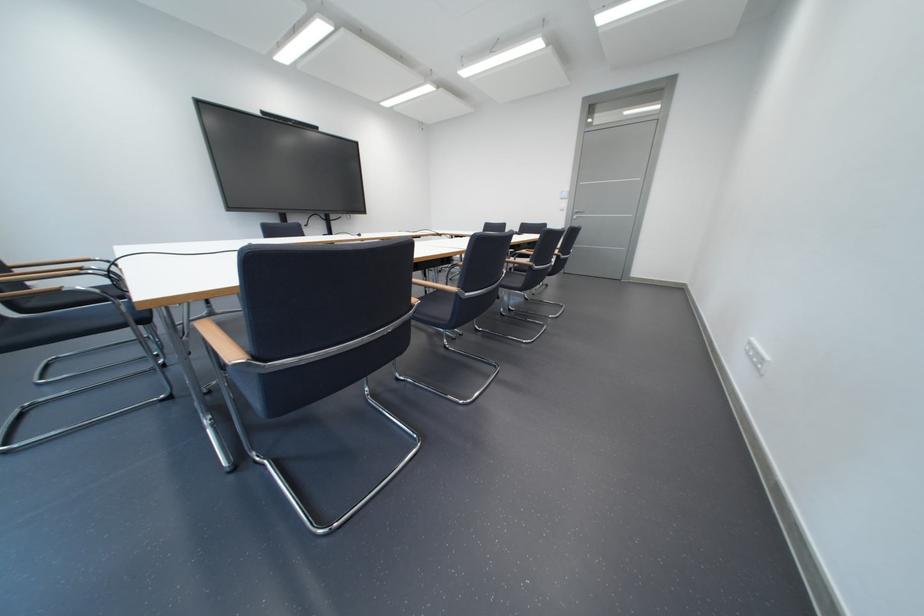
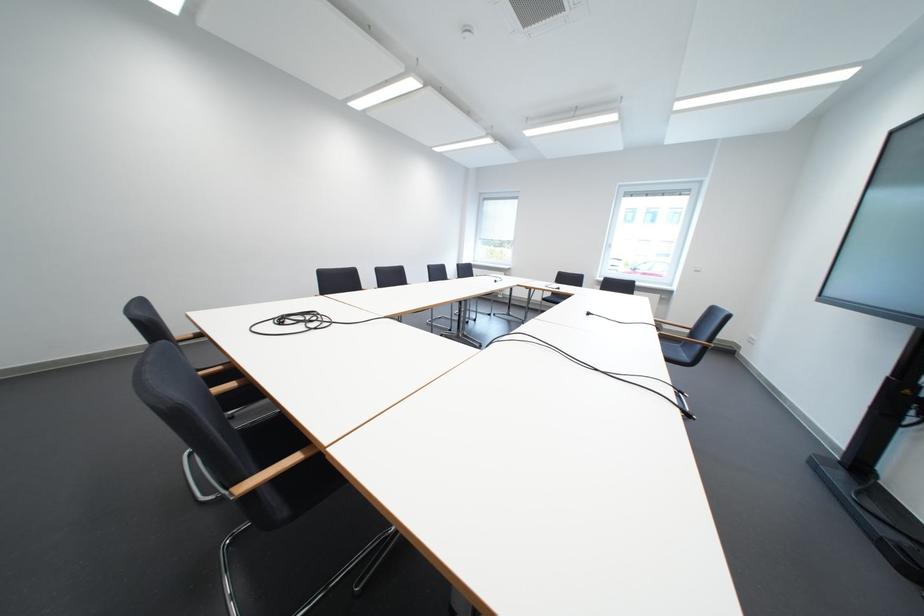
Locate, in the second image, the point that corresponds to [371,237] in the first image.

(601, 315)